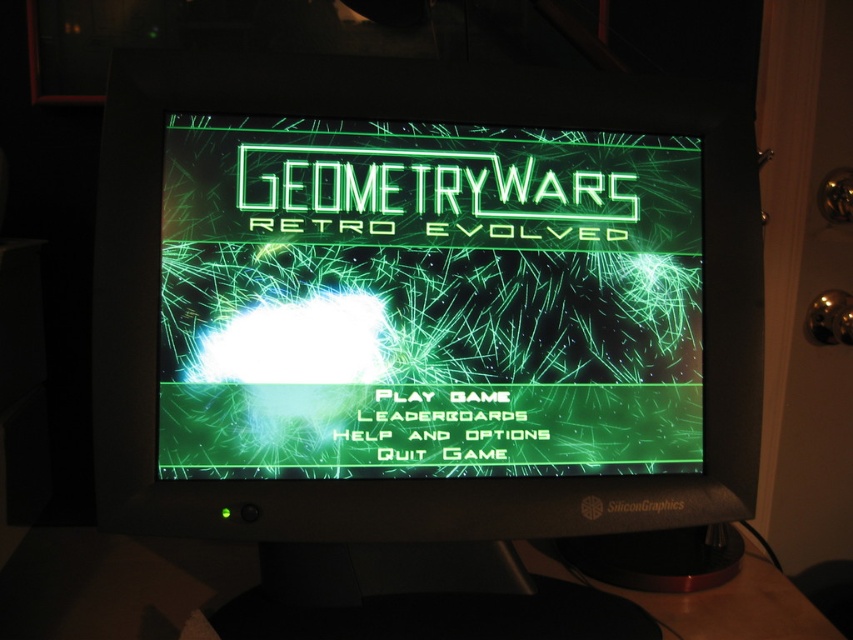
Question: Does green matte text at center have a larger size compared to black plastic table at lower center?

Choices:
 (A) no
 (B) yes

Answer: (B)

Question: Observing the image, what is the correct spatial positioning of green matte text at center in reference to black plastic table at lower center?

Choices:
 (A) left
 (B) right

Answer: (B)

Question: Which of the following is the closest to the observer?

Choices:
 (A) green matte text at center
 (B) black plastic table at lower center

Answer: (A)

Question: Which object is closer to the camera taking this photo?

Choices:
 (A) green matte text at center
 (B) black plastic table at lower center

Answer: (A)

Question: Is green matte text at center further to the viewer compared to black plastic table at lower center?

Choices:
 (A) no
 (B) yes

Answer: (A)